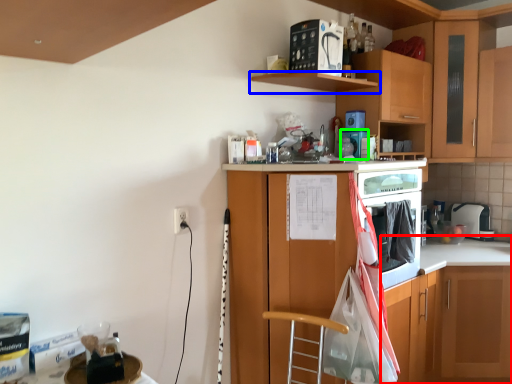
Question: Which is farther away from counter (highlighted by a red box)? shelf (highlighted by a blue box) or appliance (highlighted by a green box)?

Choices:
 (A) shelf
 (B) appliance

Answer: (A)